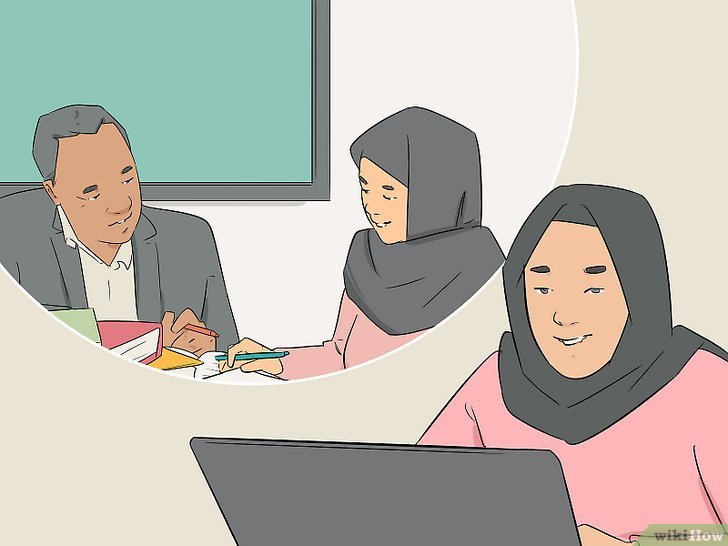
Locate an element on the screen. The width and height of the screenshot is (728, 546). pink book cover is located at coordinates (124, 327).